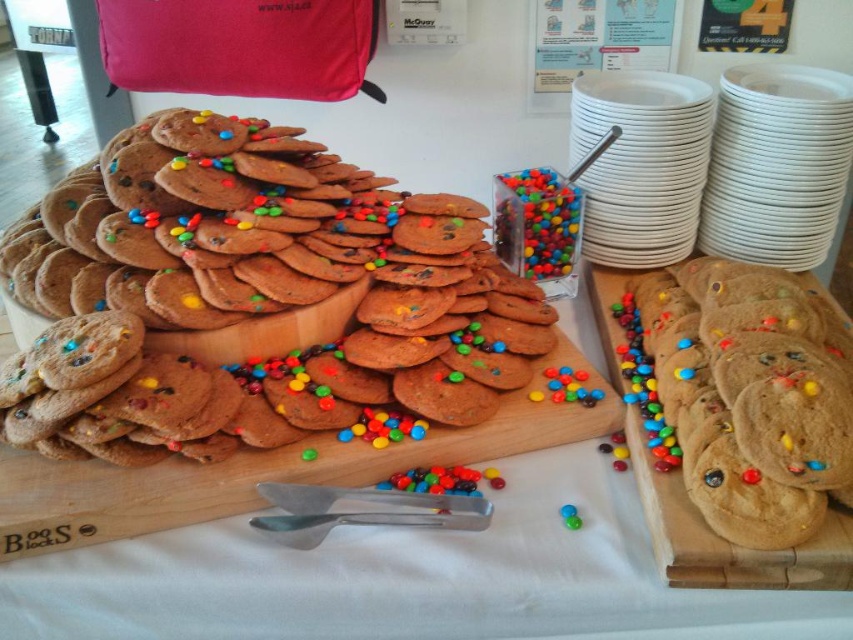
How far apart are chocolate chip cookies at center and brown matte cookie at center?

The distance of chocolate chip cookies at center from brown matte cookie at center is 37.46 centimeters.

Between chocolate chip cookies at center and brown matte cookie at center, which one is positioned higher?

chocolate chip cookies at center

The image size is (853, 640). Describe the element at coordinates (267, 253) in the screenshot. I see `chocolate chip cookies at center` at that location.

Where is `chocolate chip cookies at center`? The image size is (853, 640). chocolate chip cookies at center is located at coordinates (267, 253).

Which is below, brown matte cookie at center or brown wooden board at center?

brown wooden board at center

Describe the element at coordinates (747, 394) in the screenshot. I see `brown matte cookie at center` at that location.

Locate an element on the screen. Image resolution: width=853 pixels, height=640 pixels. brown matte cookie at center is located at coordinates (747, 394).

Does chocolate chip cookies at center appear under brown wooden board at center?

No, chocolate chip cookies at center is not below brown wooden board at center.

Is point (495, 300) closer to viewer compared to point (641, 486)?

No, (495, 300) is behind (641, 486).

Where is `chocolate chip cookies at center`? The image size is (853, 640). chocolate chip cookies at center is located at coordinates (267, 253).